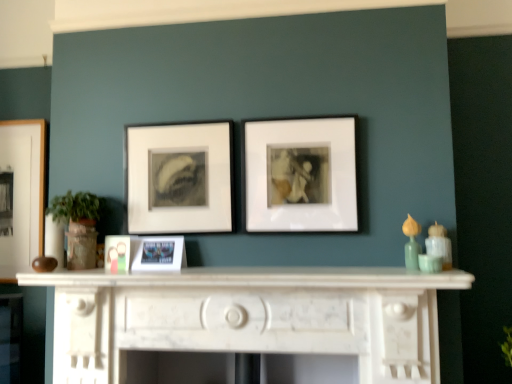
Find the location of a particular element. free spot in front of metallic silver photo frame at center, acting as the 3th picture frame starting from the right is located at coordinates (149, 276).